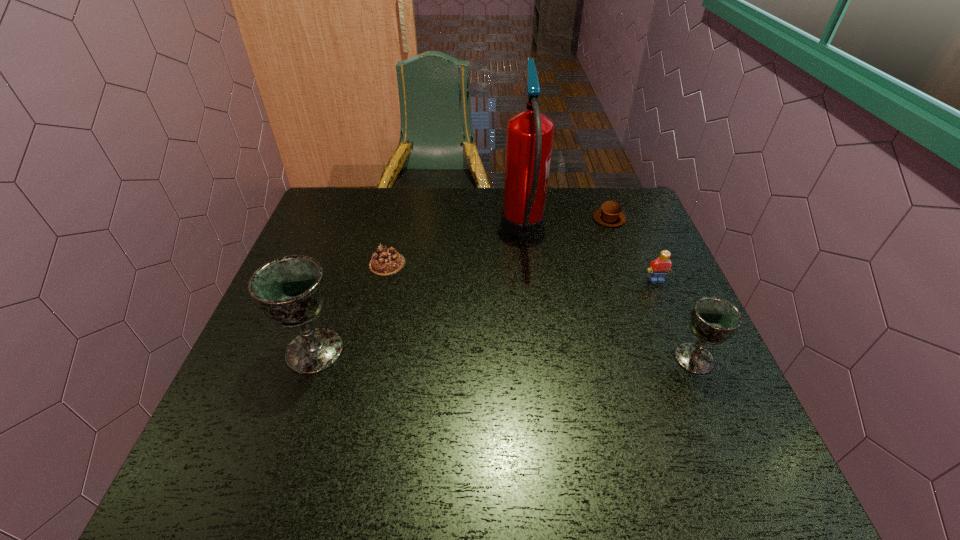
Identify which object is the third nearest to the shorter chalice. Please provide its 2D coordinates. Your answer should be formatted as a tuple, i.e. [(x, y)], where the tuple contains the x and y coordinates of a point satisfying the conditions above.

[(609, 214)]